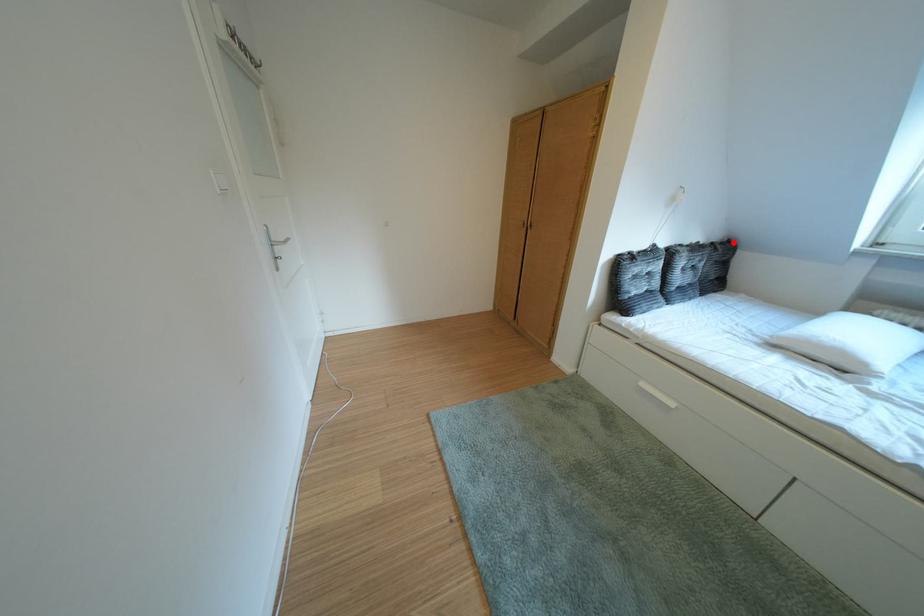
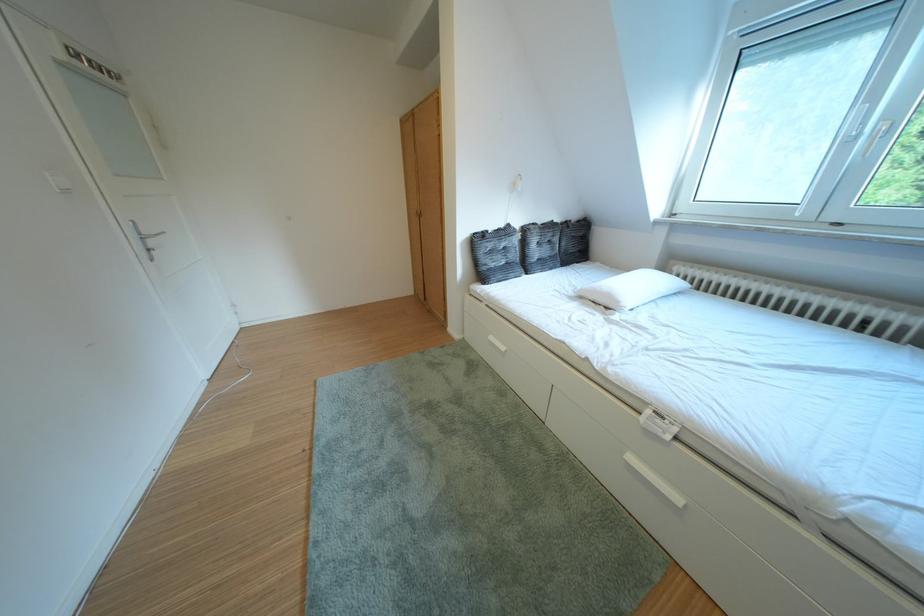
Find the pixel in the second image that matches the highlighted location in the first image.

(588, 222)